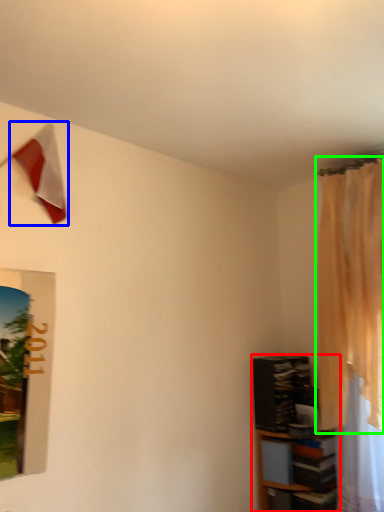
Question: Which object is positioned farthest from shelf (highlighted by a red box)? Select from flag (highlighted by a blue box) and curtain (highlighted by a green box).

Choices:
 (A) flag
 (B) curtain

Answer: (A)